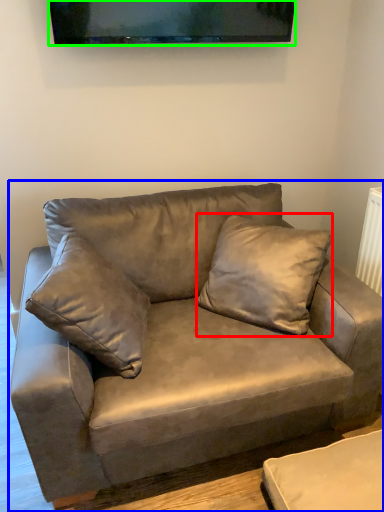
Question: Which object is positioned farthest from pillow (highlighted by a red box)? Select from studio couch (highlighted by a blue box) and television (highlighted by a green box).

Choices:
 (A) studio couch
 (B) television

Answer: (B)